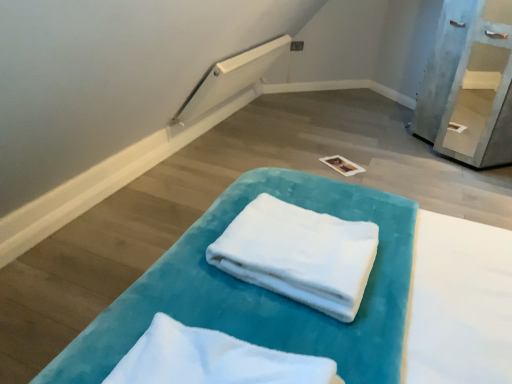
The image size is (512, 384). What do you see at coordinates (263, 289) in the screenshot?
I see `velvet teal towel at center` at bounding box center [263, 289].

The image size is (512, 384). I want to click on white soft towel at center, which is counted as the 1th cloth, starting from the front, so [x=213, y=359].

The width and height of the screenshot is (512, 384). What do you see at coordinates (213, 359) in the screenshot?
I see `white soft towel at center, which appears as the 2th cloth when viewed from the back` at bounding box center [213, 359].

This screenshot has width=512, height=384. Find the location of `white soft towel at center, the second cloth in the front-to-back sequence`. white soft towel at center, the second cloth in the front-to-back sequence is located at coordinates (298, 254).

Does velvet teal towel at center turn towards white soft towel at center, the second cloth in the front-to-back sequence?

No, velvet teal towel at center is not oriented towards white soft towel at center, the second cloth in the front-to-back sequence.

Is there a large distance between velvet teal towel at center and white soft towel at center, placed as the first cloth when sorted from back to front?

No, velvet teal towel at center is in close proximity to white soft towel at center, placed as the first cloth when sorted from back to front.

Is velvet teal towel at center inside or outside of white soft towel at center, the second cloth in the front-to-back sequence?

velvet teal towel at center is not inside white soft towel at center, the second cloth in the front-to-back sequence, it's outside.

Between point (189, 231) and point (281, 253), which one is positioned behind?

The point (189, 231) is farther from the camera.

In the image, is velvet teal towel at center on the left side or the right side of white soft towel at center, which is counted as the 1th cloth, starting from the front?

Clearly, velvet teal towel at center is on the right of white soft towel at center, which is counted as the 1th cloth, starting from the front, in the image.

Is velvet teal towel at center in contact with white soft towel at center, which is counted as the 1th cloth, starting from the front?

→ No, velvet teal towel at center is not beside white soft towel at center, which is counted as the 1th cloth, starting from the front.

Does velvet teal towel at center have a lesser width compared to white soft towel at center, which appears as the 2th cloth when viewed from the back?

Incorrect, the width of velvet teal towel at center is not less than that of white soft towel at center, which appears as the 2th cloth when viewed from the back.

Is velvet teal towel at center oriented away from white soft towel at center, which appears as the 2th cloth when viewed from the back?

No, velvet teal towel at center is not facing away from white soft towel at center, which appears as the 2th cloth when viewed from the back.

Where is `shelf above the white soft towel at center, the second cloth in the front-to-back sequence (from the image's perspective)`? The height and width of the screenshot is (384, 512). shelf above the white soft towel at center, the second cloth in the front-to-back sequence (from the image's perspective) is located at coordinates (482, 92).

Is light blue painted wood shelf at upper right oriented towards white soft towel at center, the second cloth in the front-to-back sequence?

No, light blue painted wood shelf at upper right is not oriented towards white soft towel at center, the second cloth in the front-to-back sequence.

Can white soft towel at center, placed as the first cloth when sorted from back to front, be found inside light blue painted wood shelf at upper right?

Actually, white soft towel at center, placed as the first cloth when sorted from back to front, is outside light blue painted wood shelf at upper right.

How many degrees apart are the facing directions of light blue painted wood shelf at upper right and white soft towel at center, placed as the first cloth when sorted from back to front?

47.9 degrees separate the facing orientations of light blue painted wood shelf at upper right and white soft towel at center, placed as the first cloth when sorted from back to front.

Considering the sizes of light blue painted wood shelf at upper right and white soft towel at center, which is counted as the 1th cloth, starting from the front, in the image, is light blue painted wood shelf at upper right bigger or smaller than white soft towel at center, which is counted as the 1th cloth, starting from the front,?

Clearly, light blue painted wood shelf at upper right is larger in size than white soft towel at center, which is counted as the 1th cloth, starting from the front.

Is white soft towel at center, which appears as the 2th cloth when viewed from the back, at the back of light blue painted wood shelf at upper right?

No, light blue painted wood shelf at upper right is not facing the opposite direction of white soft towel at center, which appears as the 2th cloth when viewed from the back.

Can you confirm if light blue painted wood shelf at upper right is taller than white soft towel at center, which is counted as the 1th cloth, starting from the front?

Indeed, light blue painted wood shelf at upper right has a greater height compared to white soft towel at center, which is counted as the 1th cloth, starting from the front.

Is point (108, 375) less distant than point (495, 60)?

That is True.

Considering the sizes of objects white soft towel at center, which appears as the 2th cloth when viewed from the back, and light blue painted wood shelf at upper right in the image provided, who is bigger, white soft towel at center, which appears as the 2th cloth when viewed from the back, or light blue painted wood shelf at upper right?

light blue painted wood shelf at upper right.

Find the location of a particular element. shelf that is behind the white soft towel at center, which is counted as the 1th cloth, starting from the front is located at coordinates (482, 92).

Is light blue painted wood shelf at upper right a part of white soft towel at center, which is counted as the 1th cloth, starting from the front?

Definitely not — light blue painted wood shelf at upper right is not inside white soft towel at center, which is counted as the 1th cloth, starting from the front.

How many degrees apart are the facing directions of white soft towel at center, placed as the first cloth when sorted from back to front, and white soft towel at center, which is counted as the 1th cloth, starting from the front?

1.61 degrees separate the facing orientations of white soft towel at center, placed as the first cloth when sorted from back to front, and white soft towel at center, which is counted as the 1th cloth, starting from the front.

Does white soft towel at center, the second cloth in the front-to-back sequence, come behind white soft towel at center, which is counted as the 1th cloth, starting from the front?

Yes, it is.

Based on their sizes in the image, would you say white soft towel at center, placed as the first cloth when sorted from back to front, is bigger or smaller than white soft towel at center, which is counted as the 1th cloth, starting from the front?

white soft towel at center, placed as the first cloth when sorted from back to front, is bigger than white soft towel at center, which is counted as the 1th cloth, starting from the front.

Is white soft towel at center, placed as the first cloth when sorted from back to front, not near white soft towel at center, which appears as the 2th cloth when viewed from the back?

No, white soft towel at center, placed as the first cloth when sorted from back to front, is in close proximity to white soft towel at center, which appears as the 2th cloth when viewed from the back.

Which is closer to the camera, (x=339, y=319) or (x=83, y=367)?

The point (x=83, y=367) is closer to the camera.

Could velvet teal towel at center be considered to be inside white soft towel at center, the second cloth in the front-to-back sequence?

No, velvet teal towel at center is not inside white soft towel at center, the second cloth in the front-to-back sequence.

There is a velvet teal towel at center. Find the location of `the 1st cloth above it (from a real-world perspective)`. the 1st cloth above it (from a real-world perspective) is located at coordinates (298, 254).

Considering the relative positions of white soft towel at center, the second cloth in the front-to-back sequence, and velvet teal towel at center in the image provided, is white soft towel at center, the second cloth in the front-to-back sequence, to the right of velvet teal towel at center from the viewer's perspective?

In fact, white soft towel at center, the second cloth in the front-to-back sequence, is to the left of velvet teal towel at center.

Locate an element on the screen. furniture located in front of the white soft towel at center, placed as the first cloth when sorted from back to front is located at coordinates (263, 289).

In order to click on cloth that is the 2nd object to the left of the velvet teal towel at center, starting at the anchor in this screenshot , I will do `click(213, 359)`.

Based on their spatial positions, is light blue painted wood shelf at upper right or velvet teal towel at center closer to white soft towel at center, the second cloth in the front-to-back sequence?

Among the two, velvet teal towel at center is located nearer to white soft towel at center, the second cloth in the front-to-back sequence.

Looking at the image, which one is located further to white soft towel at center, which appears as the 2th cloth when viewed from the back, velvet teal towel at center or white soft towel at center, placed as the first cloth when sorted from back to front?

white soft towel at center, placed as the first cloth when sorted from back to front.

Which object lies nearer to the anchor point light blue painted wood shelf at upper right, white soft towel at center, which appears as the 2th cloth when viewed from the back, or white soft towel at center, the second cloth in the front-to-back sequence?

Among the two, white soft towel at center, the second cloth in the front-to-back sequence, is located nearer to light blue painted wood shelf at upper right.

From the image, which object appears to be nearer to white soft towel at center, which is counted as the 1th cloth, starting from the front, light blue painted wood shelf at upper right or white soft towel at center, placed as the first cloth when sorted from back to front?

The object closer to white soft towel at center, which is counted as the 1th cloth, starting from the front, is white soft towel at center, placed as the first cloth when sorted from back to front.

When comparing their distances from white soft towel at center, the second cloth in the front-to-back sequence, does velvet teal towel at center or white soft towel at center, which is counted as the 1th cloth, starting from the front, seem closer?

velvet teal towel at center is positioned closer to the anchor white soft towel at center, the second cloth in the front-to-back sequence.

When comparing their distances from velvet teal towel at center, does light blue painted wood shelf at upper right or white soft towel at center, which appears as the 2th cloth when viewed from the back, seem further?

light blue painted wood shelf at upper right lies further to velvet teal towel at center than the other object.

When comparing their distances from white soft towel at center, the second cloth in the front-to-back sequence, does velvet teal towel at center or light blue painted wood shelf at upper right seem closer?

velvet teal towel at center.

From the image, which object appears to be farther from velvet teal towel at center, white soft towel at center, which appears as the 2th cloth when viewed from the back, or light blue painted wood shelf at upper right?

light blue painted wood shelf at upper right is further to velvet teal towel at center.

Locate an element on the screen. Image resolution: width=512 pixels, height=384 pixels. cloth positioned between white soft towel at center, which is counted as the 1th cloth, starting from the front, and light blue painted wood shelf at upper right from near to far is located at coordinates (298, 254).

Locate an element on the screen. The height and width of the screenshot is (384, 512). furniture between white soft towel at center, which is counted as the 1th cloth, starting from the front, and light blue painted wood shelf at upper right from front to back is located at coordinates (263, 289).

You are a GUI agent. You are given a task and a screenshot of the screen. Output one action in this format:
    pyautogui.click(x=<x>, y=<y>)
    Task: Click on the cloth between white soft towel at center, which is counted as the 1th cloth, starting from the front, and velvet teal towel at center, in the horizontal direction
    This screenshot has height=384, width=512.
    Given the screenshot: What is the action you would take?
    pyautogui.click(x=298, y=254)

Where is `cloth between velvet teal towel at center and light blue painted wood shelf at upper right from front to back`? The image size is (512, 384). cloth between velvet teal towel at center and light blue painted wood shelf at upper right from front to back is located at coordinates (298, 254).